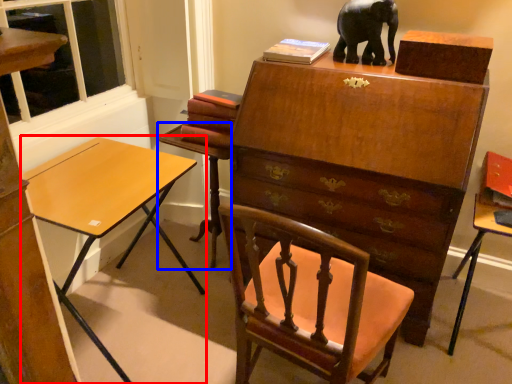
Question: Which object appears closest to the camera in this image, desk (highlighted by a red box) or table (highlighted by a blue box)?

Choices:
 (A) desk
 (B) table

Answer: (A)